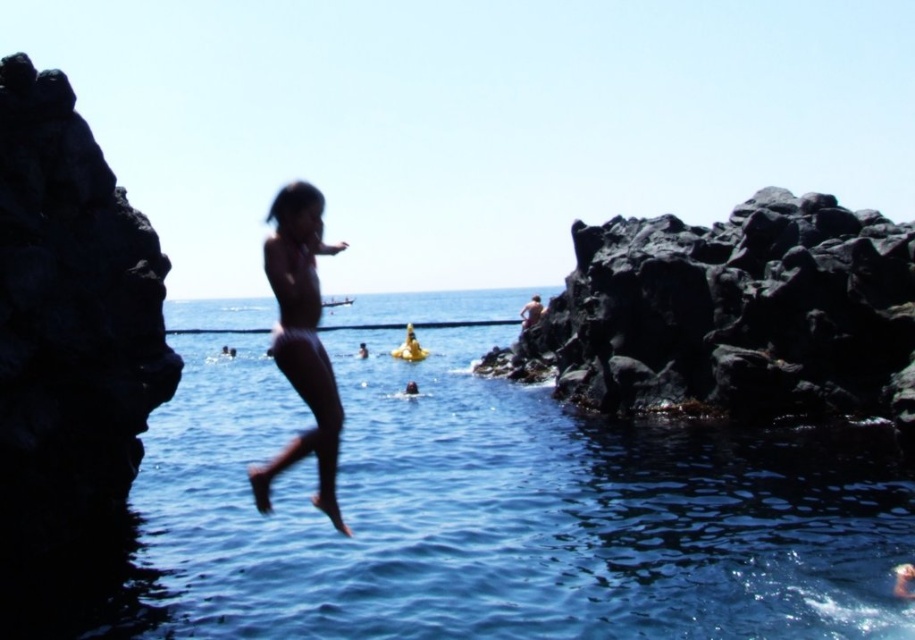
Is smooth skin figure at center taller than smooth skin man at center?

Indeed, smooth skin figure at center has a greater height compared to smooth skin man at center.

Which is below, smooth skin figure at center or smooth skin man at center?

smooth skin figure at center

Consider the image. Who is more distant from viewer, (316, 358) or (542, 305)?

Point (542, 305)

Image resolution: width=915 pixels, height=640 pixels. Identify the location of smooth skin figure at center. (300, 340).

Can you confirm if transparent blue water at center is shorter than smooth skin man at center?

In fact, transparent blue water at center may be taller than smooth skin man at center.

Which is above, transparent blue water at center or smooth skin man at center?

smooth skin man at center

Which is behind, point (682, 577) or point (526, 324)?

Positioned behind is point (526, 324).

Locate an element on the screen. transparent blue water at center is located at coordinates (501, 513).

In the scene shown: Who is taller, transparent blue water at center or smooth skin figure at center?

smooth skin figure at center

Does point (424, 525) lie in front of point (280, 305)?

No, it is not.

Identify the location of transparent blue water at center. (501, 513).